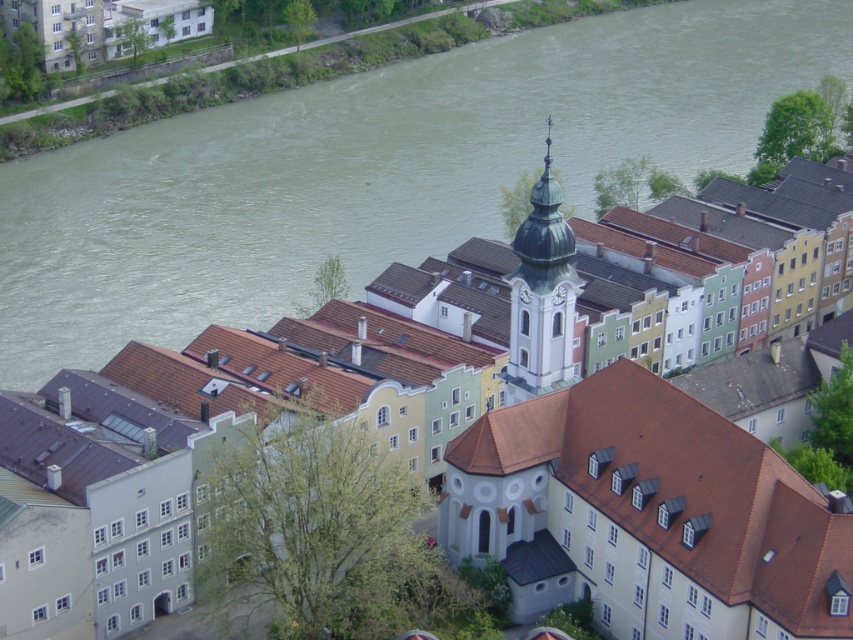
Between point (26, 381) and point (196, 29), which one is positioned in front?

Point (26, 381) is more forward.

Can you confirm if greenish-gray water at upper left is thinner than matte white church at upper left?

In fact, greenish-gray water at upper left might be wider than matte white church at upper left.

At what (x,y) coordinates should I click in order to perform the action: click on greenish-gray water at upper left. Please return your answer as a coordinate pair (x, y). Looking at the image, I should click on (373, 170).

Identify the location of greenish-gray water at upper left. The image size is (853, 640). (373, 170).

In the scene shown: Is greenish-gray water at upper left further to camera compared to white smooth church at center?

Yes, it is behind white smooth church at center.

Is greenish-gray water at upper left to the right of white smooth church at center from the viewer's perspective?

In fact, greenish-gray water at upper left is to the left of white smooth church at center.

Who is more distant from viewer, (x=502, y=116) or (x=688, y=561)?

Point (x=502, y=116)

The image size is (853, 640). Find the location of `greenish-gray water at upper left`. greenish-gray water at upper left is located at coordinates click(373, 170).

Who is more distant from viewer, [515,316] or [154,29]?

The point [154,29] is more distant.

Is green glass spire at center further to the viewer compared to matte white church at upper left?

No, green glass spire at center is closer to the viewer.

Is point (572, 291) positioned after point (129, 10)?

No.

Identify the location of green glass spire at center. (541, 296).